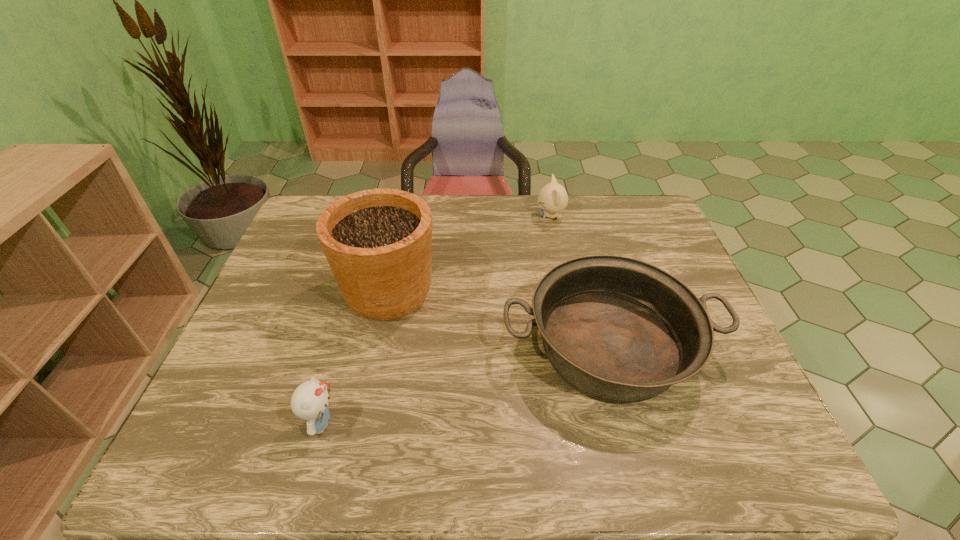
Where is `free spot between the farthest object and the flowerpot`? This screenshot has width=960, height=540. free spot between the farthest object and the flowerpot is located at coordinates (469, 254).

You are a GUI agent. You are given a task and a screenshot of the screen. Output one action in this format:
    pyautogui.click(x=<x>, y=<y>)
    Task: Click on the free space between the pan and the nearer kitten
    The width and height of the screenshot is (960, 540).
    Given the screenshot: What is the action you would take?
    pyautogui.click(x=465, y=384)

Identify the location of free space that is in between the pan and the left kitten. The height and width of the screenshot is (540, 960). (465, 384).

Identify the location of object identified as the third closest to the left kitten. (553, 198).

Identify which object is the second nearest to the farther kitten. Please provide its 2D coordinates. Your answer should be formatted as a tuple, i.e. [(x, y)], where the tuple contains the x and y coordinates of a point satisfying the conditions above.

[(378, 242)]

Where is `free space that satisfies the following two spatial constraints: 1. on the back side of the pan; 2. on the face of the farthest object`? Image resolution: width=960 pixels, height=540 pixels. free space that satisfies the following two spatial constraints: 1. on the back side of the pan; 2. on the face of the farthest object is located at coordinates (574, 216).

The width and height of the screenshot is (960, 540). I want to click on vacant space that satisfies the following two spatial constraints: 1. on the back side of the pan; 2. on the face of the farther kitten, so click(574, 216).

Identify the location of free location that satisfies the following two spatial constraints: 1. on the back side of the pan; 2. on the face of the farthest object. (574, 216).

Locate an element on the screen. vacant position in the image that satisfies the following two spatial constraints: 1. on the face of the right kitten; 2. on the left side of the pan is located at coordinates click(577, 346).

At what (x,y) coordinates should I click in order to perform the action: click on vacant space that satisfies the following two spatial constraints: 1. on the face of the right kitten; 2. on the left side of the pan. Please return your answer as a coordinate pair (x, y). This screenshot has width=960, height=540. Looking at the image, I should click on (577, 346).